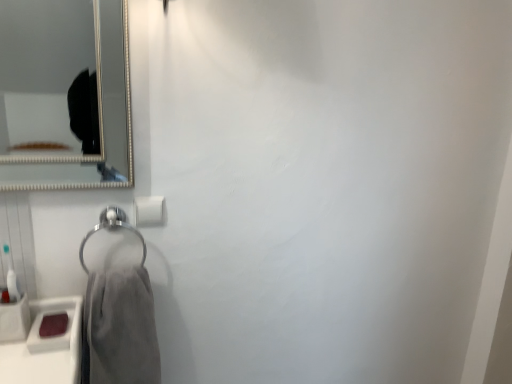
You are a GUI agent. You are given a task and a screenshot of the screen. Output one action in this format:
    pyautogui.click(x=<x>, y=<y>)
    Task: Click on the matte pink soap at lower left
    This screenshot has height=384, width=512.
    Given the screenshot: What is the action you would take?
    pyautogui.click(x=53, y=314)

Where is `satin silver towel ring at lower left`? satin silver towel ring at lower left is located at coordinates (111, 228).

Where is `matte pink soap at lower left`? This screenshot has width=512, height=384. matte pink soap at lower left is located at coordinates (53, 314).

Are gray cotton towel at lower left and satin silver towel ring at lower left located far from each other?

No, gray cotton towel at lower left is in close proximity to satin silver towel ring at lower left.

From a real-world perspective, is gray cotton towel at lower left over satin silver towel ring at lower left?

No, from a real-world perspective, gray cotton towel at lower left is not above satin silver towel ring at lower left.

Between gray cotton towel at lower left and satin silver towel ring at lower left, which one has less height?

Standing shorter between the two is satin silver towel ring at lower left.

The width and height of the screenshot is (512, 384). Find the location of `hang below the white matte toilet paper at center (from a real-world perspective)`. hang below the white matte toilet paper at center (from a real-world perspective) is located at coordinates click(x=111, y=228).

Which is farther from the camera, (156, 220) or (95, 229)?

Point (156, 220)

Is white matte toilet paper at center in contact with satin silver towel ring at lower left?

Yes, white matte toilet paper at center is next to satin silver towel ring at lower left.

From the picture: How different are the orientations of white matte toilet paper at center and satin silver towel ring at lower left in degrees?

0.0489 degrees separate the facing orientations of white matte toilet paper at center and satin silver towel ring at lower left.

Based on their sizes in the image, would you say satin silver towel ring at lower left is bigger or smaller than gray cotton towel at lower left?

satin silver towel ring at lower left is smaller than gray cotton towel at lower left.

Considering the relative sizes of satin silver towel ring at lower left and gray cotton towel at lower left in the image provided, is satin silver towel ring at lower left thinner than gray cotton towel at lower left?

Yes.

From the image's perspective, which one is positioned higher, satin silver towel ring at lower left or gray cotton towel at lower left?

From the image's view, satin silver towel ring at lower left is above.

I want to click on toilet paper above the matte pink soap at lower left (from a real-world perspective), so click(x=149, y=210).

What's the angular difference between matte pink soap at lower left and white matte toilet paper at center's facing directions?

They differ by 0.634 degrees in their facing directions.

Is matte pink soap at lower left closer to camera compared to white matte toilet paper at center?

That is True.

Could you tell me if matte pink soap at lower left is facing white matte toilet paper at center?

No, matte pink soap at lower left does not turn towards white matte toilet paper at center.

In the scene shown: Considering the relative sizes of white matte toilet paper at center and matte pink soap at lower left in the image provided, is white matte toilet paper at center taller than matte pink soap at lower left?

Yes.

Is white matte toilet paper at center aimed at matte pink soap at lower left?

No, white matte toilet paper at center is not turned towards matte pink soap at lower left.

The image size is (512, 384). Find the location of `toilet paper above the matte pink soap at lower left (from the image's perspective)`. toilet paper above the matte pink soap at lower left (from the image's perspective) is located at coordinates (149, 210).

Is the depth of matte pink soap at lower left greater than that of satin silver towel ring at lower left?

That is False.

Does matte pink soap at lower left have a larger size compared to satin silver towel ring at lower left?

No, matte pink soap at lower left is not bigger than satin silver towel ring at lower left.

Is matte pink soap at lower left turned away from satin silver towel ring at lower left?

No, matte pink soap at lower left is not facing away from satin silver towel ring at lower left.

Locate an element on the screen. The height and width of the screenshot is (384, 512). sink located on the left of satin silver towel ring at lower left is located at coordinates (53, 314).

Would you say satin silver towel ring at lower left is to the left or to the right of white matte toilet paper at center in the picture?

From the image, it's evident that satin silver towel ring at lower left is to the left of white matte toilet paper at center.

Which is correct: satin silver towel ring at lower left is inside white matte toilet paper at center, or outside of it?

satin silver towel ring at lower left is spatially situated outside white matte toilet paper at center.

Is satin silver towel ring at lower left positioned with its back to white matte toilet paper at center?

No, white matte toilet paper at center is not at the back of satin silver towel ring at lower left.

This screenshot has height=384, width=512. Find the location of `hang above the gray cotton towel at lower left (from a real-world perspective)`. hang above the gray cotton towel at lower left (from a real-world perspective) is located at coordinates (111, 228).

This screenshot has width=512, height=384. In order to click on hang located below the white matte toilet paper at center (from the image's perspective) in this screenshot , I will do `click(111, 228)`.

Estimate the real-world distances between objects in this image. Which object is further from satin silver towel ring at lower left, gray cotton towel at lower left or white matte toilet paper at center?

gray cotton towel at lower left lies further to satin silver towel ring at lower left than the other object.

Which object lies nearer to the anchor point white matte toilet paper at center, matte pink soap at lower left or gray cotton towel at lower left?

gray cotton towel at lower left.

When comparing their distances from satin silver towel ring at lower left, does white matte toilet paper at center or matte pink soap at lower left seem further?

matte pink soap at lower left.

Based on the photo, considering their positions, is gray cotton towel at lower left positioned closer to white matte toilet paper at center than satin silver towel ring at lower left?

Among the two, satin silver towel ring at lower left is located nearer to white matte toilet paper at center.

Considering their positions, is matte pink soap at lower left positioned closer to gray cotton towel at lower left than satin silver towel ring at lower left?

The object closer to gray cotton towel at lower left is matte pink soap at lower left.

From the picture: Estimate the real-world distances between objects in this image. Which object is closer to white matte toilet paper at center, satin silver towel ring at lower left or matte pink soap at lower left?

satin silver towel ring at lower left is closer to white matte toilet paper at center.

Looking at the image, which one is located further to matte pink soap at lower left, white matte toilet paper at center or gray cotton towel at lower left?

The object further to matte pink soap at lower left is white matte toilet paper at center.

Based on the photo, from the image, which object appears to be nearer to gray cotton towel at lower left, satin silver towel ring at lower left or white matte toilet paper at center?

Based on the image, satin silver towel ring at lower left appears to be nearer to gray cotton towel at lower left.

The height and width of the screenshot is (384, 512). I want to click on hang that lies between white matte toilet paper at center and matte pink soap at lower left from top to bottom, so click(x=111, y=228).

Image resolution: width=512 pixels, height=384 pixels. Identify the location of sink between satin silver towel ring at lower left and gray cotton towel at lower left in the up-down direction. (53, 314).

This screenshot has height=384, width=512. I want to click on hang between white matte toilet paper at center and gray cotton towel at lower left vertically, so coord(111,228).

The width and height of the screenshot is (512, 384). In order to click on sink between white matte toilet paper at center and gray cotton towel at lower left in the up-down direction in this screenshot , I will do `click(53, 314)`.